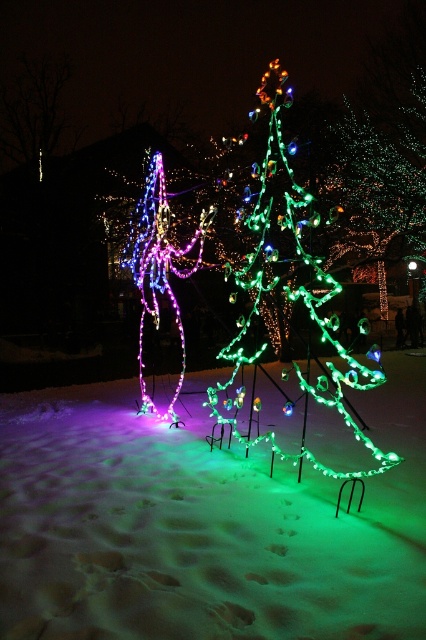
Question: Among these points, which one is farthest from the camera?

Choices:
 (A) (161, 268)
 (B) (163, 378)

Answer: (B)

Question: Which of the following is the closest to the observer?

Choices:
 (A) (279, 109)
 (B) (169, 397)
 (C) (183, 563)

Answer: (C)

Question: Is green frosted snow at lower center closer to camera compared to green illuminated tree at center?

Choices:
 (A) yes
 (B) no

Answer: (A)

Question: Among these points, which one is nearest to the camera?

Choices:
 (A) (201, 227)
 (B) (261, 273)

Answer: (B)

Question: Does green illuminated tree at center have a lesser width compared to illuminated plastic christmas tree at center?

Choices:
 (A) no
 (B) yes

Answer: (A)

Question: Is green frosted snow at lower center positioned at the back of illuminated plastic christmas tree at center?

Choices:
 (A) no
 (B) yes

Answer: (A)